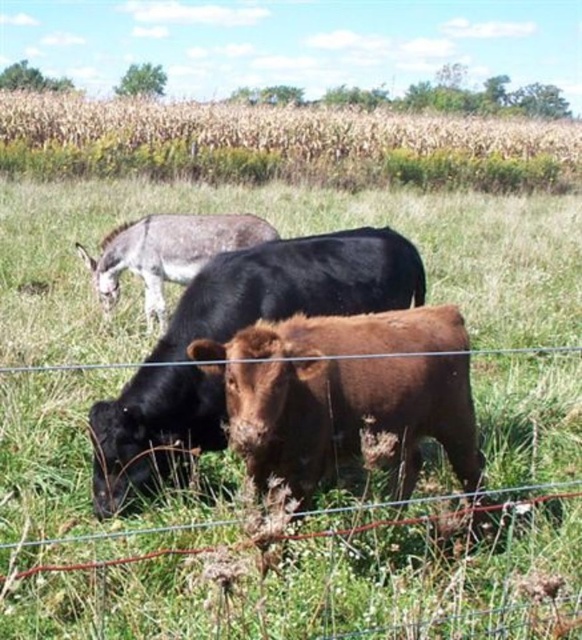
Question: Which object appears closest to the camera in this image?

Choices:
 (A) brown furry bull at center
 (B) brown matte cow at center
 (C) wire mesh at lower center
 (D) gray matte donkey at upper left

Answer: (C)

Question: Is golden wheat field at upper center above brown furry bull at center?

Choices:
 (A) yes
 (B) no

Answer: (A)

Question: Is brown furry bull at center closer to the viewer compared to brown matte cow at center?

Choices:
 (A) no
 (B) yes

Answer: (B)

Question: Which object appears closest to the camera in this image?

Choices:
 (A) brown matte cow at center
 (B) wire mesh at lower center

Answer: (B)

Question: Among these objects, which one is farthest from the camera?

Choices:
 (A) wire mesh at lower center
 (B) gray matte donkey at upper left
 (C) brown furry bull at center

Answer: (B)

Question: Can you confirm if wire mesh at lower center is thinner than brown matte cow at center?

Choices:
 (A) yes
 (B) no

Answer: (B)